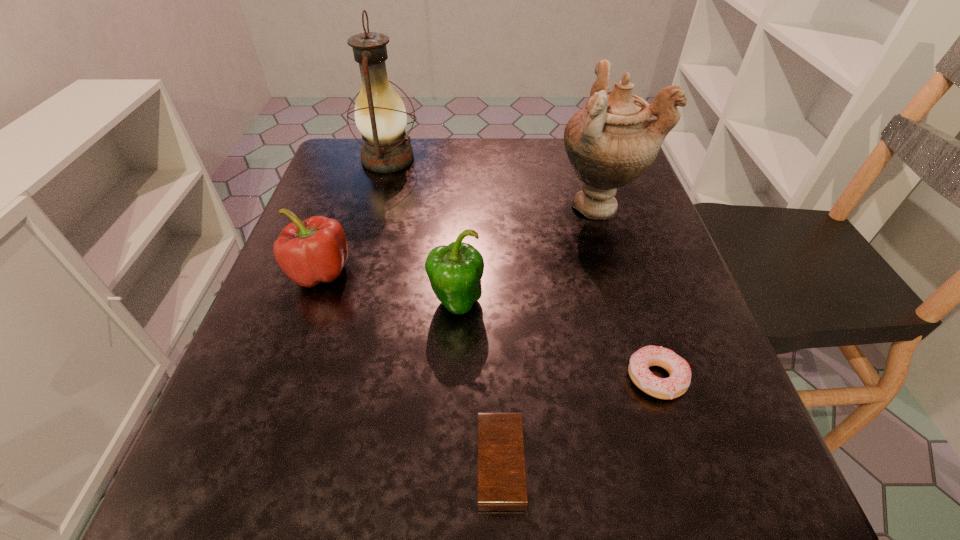
Image resolution: width=960 pixels, height=540 pixels. Identify the location of oil lamp. (380, 115).

Find the location of a particular element. urn is located at coordinates (612, 141).

Locate an element on the screen. This screenshot has width=960, height=540. the third tallest object is located at coordinates (455, 271).

Find the location of `the taller bell pepper`. the taller bell pepper is located at coordinates (455, 271).

Locate an element on the screen. the shorter bell pepper is located at coordinates (309, 252).

The image size is (960, 540). What are the coordinates of `the left bell pepper` in the screenshot? It's located at (309, 252).

What are the coordinates of `doughnut` in the screenshot? It's located at (678, 368).

Find the location of `the second nearest object`. the second nearest object is located at coordinates (678, 368).

Where is `the shortest object`? This screenshot has width=960, height=540. the shortest object is located at coordinates (502, 486).

Where is `alarm clock`? The height and width of the screenshot is (540, 960). alarm clock is located at coordinates click(502, 486).